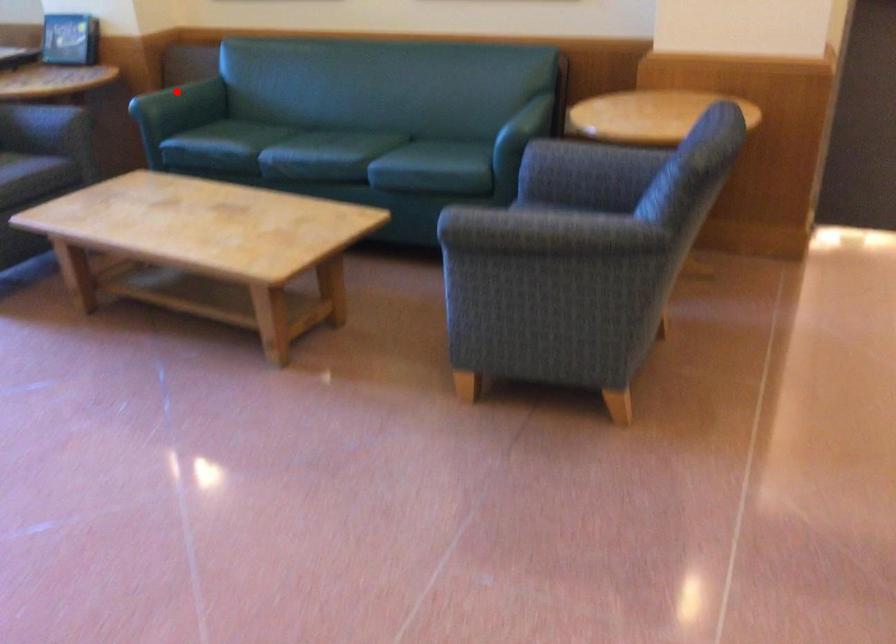
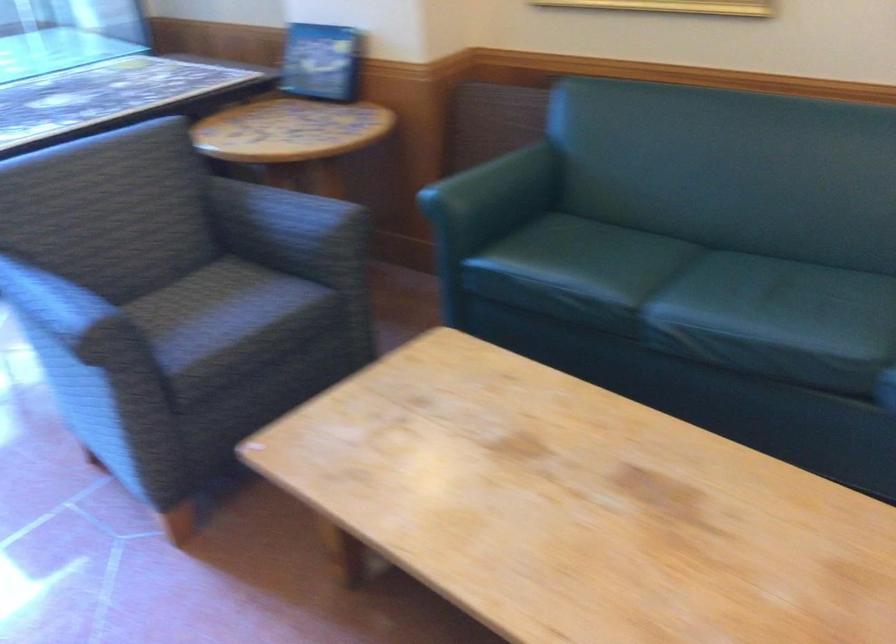
Question: A red point is marked in image1. In image2, is the corresponding 3D point closer to the camera or farther? Reply with the corresponding letter.

Choices:
 (A) The corresponding 3D point is closer.
 (B) The corresponding 3D point is farther.

Answer: (A)